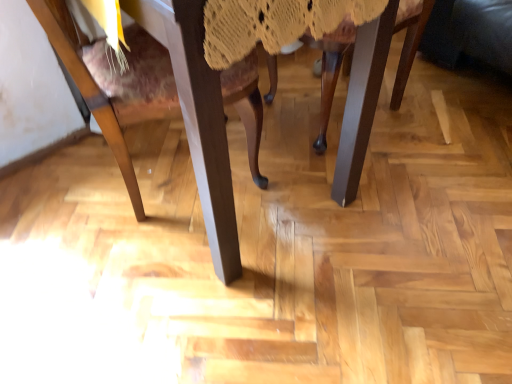
Question: Should I look upward or downward to see wooden chair leg at center, which appears as the 1th chair when viewed from the right?

Choices:
 (A) up
 (B) down

Answer: (A)

Question: Is wooden chair leg at center, the second chair positioned from the left, at the right side of wooden chair at center, the second chair positioned from the right?

Choices:
 (A) no
 (B) yes

Answer: (B)

Question: Can you confirm if wooden chair leg at center, which appears as the 1th chair when viewed from the right, is bigger than wooden chair at center, the second chair positioned from the right?

Choices:
 (A) no
 (B) yes

Answer: (A)

Question: Is wooden chair leg at center, the second chair positioned from the left, facing towards wooden chair at center, the 1th chair when ordered from left to right?

Choices:
 (A) yes
 (B) no

Answer: (A)

Question: Does wooden chair leg at center, the second chair positioned from the left, have a lesser width compared to wooden chair at center, the second chair positioned from the right?

Choices:
 (A) no
 (B) yes

Answer: (B)

Question: Can you confirm if wooden chair leg at center, which appears as the 1th chair when viewed from the right, is wider than wooden chair at center, the 1th chair when ordered from left to right?

Choices:
 (A) yes
 (B) no

Answer: (B)

Question: Is wooden chair leg at center, the second chair positioned from the left, positioned with its back to wooden chair at center, the second chair positioned from the right?

Choices:
 (A) no
 (B) yes

Answer: (A)

Question: Can you confirm if wooden chair at center, the second chair positioned from the right, is bigger than wooden chair leg at center, which appears as the 1th chair when viewed from the right?

Choices:
 (A) no
 (B) yes

Answer: (B)

Question: Does wooden chair at center, the second chair positioned from the right, turn towards wooden chair leg at center, which appears as the 1th chair when viewed from the right?

Choices:
 (A) no
 (B) yes

Answer: (B)

Question: Does wooden chair at center, the 1th chair when ordered from left to right, have a greater width compared to wooden chair leg at center, which appears as the 1th chair when viewed from the right?

Choices:
 (A) yes
 (B) no

Answer: (A)

Question: Considering the relative sizes of wooden chair at center, the second chair positioned from the right, and wooden chair leg at center, the second chair positioned from the left, in the image provided, is wooden chair at center, the second chair positioned from the right, shorter than wooden chair leg at center, the second chair positioned from the left,?

Choices:
 (A) no
 (B) yes

Answer: (A)

Question: From the image's perspective, is wooden chair at center, the 1th chair when ordered from left to right, located above wooden chair leg at center, which appears as the 1th chair when viewed from the right?

Choices:
 (A) no
 (B) yes

Answer: (A)

Question: Does wooden chair at center, the second chair positioned from the right, have a lesser width compared to wooden chair leg at center, the second chair positioned from the left?

Choices:
 (A) no
 (B) yes

Answer: (A)

Question: Is wooden chair at center, the second chair positioned from the right, bigger or smaller than wooden chair leg at center, which appears as the 1th chair when viewed from the right?

Choices:
 (A) big
 (B) small

Answer: (A)